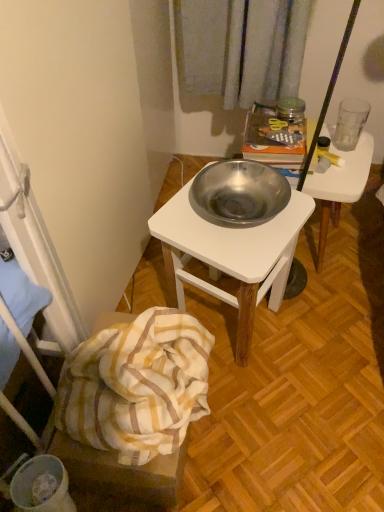
This screenshot has width=384, height=512. I want to click on vacant area situated below polished stainless steel bowl at center, positioned as the 1th desk in left-to-right order (from a real-world perspective), so click(233, 328).